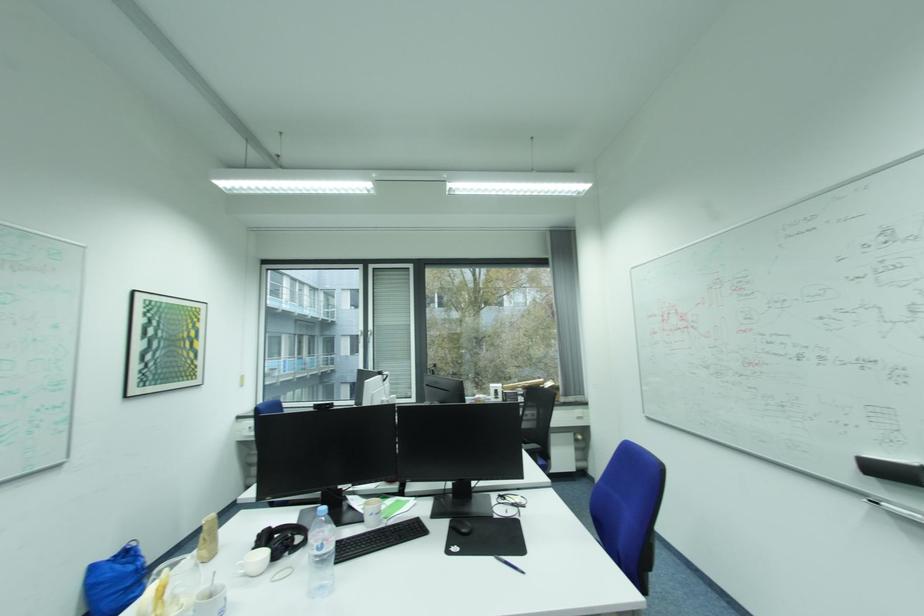
Which object does [891,469] point to?

This point indicates the black whiteboard eraser.